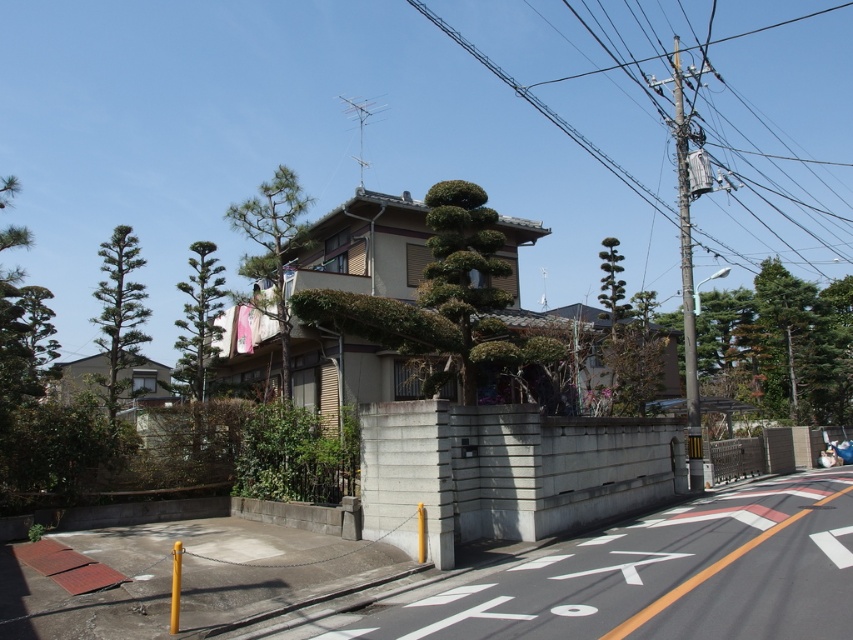
You are standing at the entrance of the house and want to walk towards the point marked as point (440, 116). Which direction should you go relative to the point marked as point (131, 241)?

Since point (440, 116) is behind point (131, 241), you should walk in the direction away from point (131, 241) to reach it.